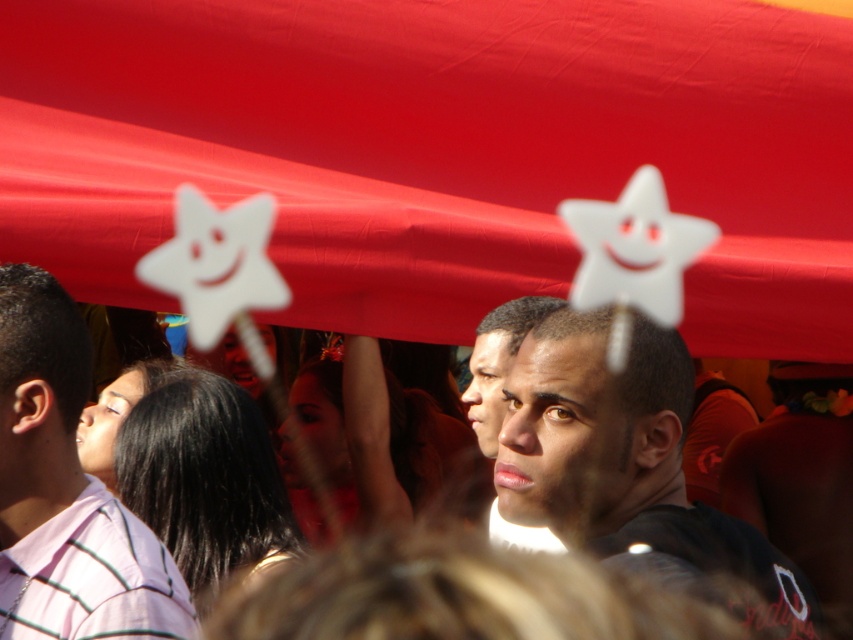
You are at a gathering under a red canopy and see two people wearing a matte black shirt at center and a pink striped shirt at left. Which person is standing more to the left?

The pink striped shirt at left is more to the left because the matte black shirt at center is on its right side.